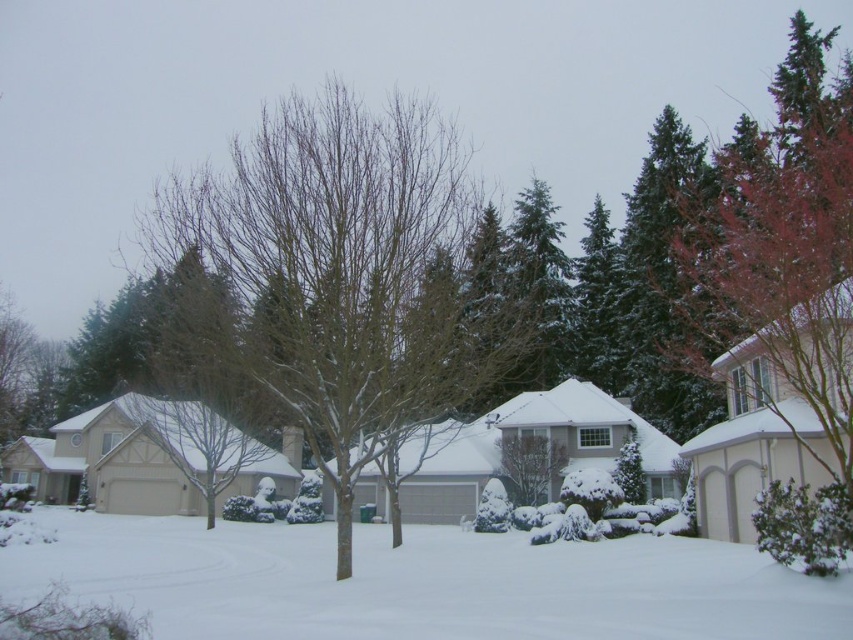
Question: Is white fluffy snow at center wider than green textured evergreen tree at center?

Choices:
 (A) yes
 (B) no

Answer: (A)

Question: Can you confirm if white fluffy snow at center is bigger than green textured evergreen tree at center?

Choices:
 (A) yes
 (B) no

Answer: (B)

Question: Among these objects, which one is nearest to the camera?

Choices:
 (A) bare branches at center
 (B) green textured evergreen tree at center

Answer: (A)

Question: Does bare branches at center have a lesser width compared to green textured evergreen tree at center?

Choices:
 (A) no
 (B) yes

Answer: (A)

Question: Which point is closer to the camera?

Choices:
 (A) (396, 396)
 (B) (521, 241)

Answer: (A)

Question: Which of the following is the closest to the observer?

Choices:
 (A) white fluffy snow at center
 (B) green textured evergreen tree at center

Answer: (A)